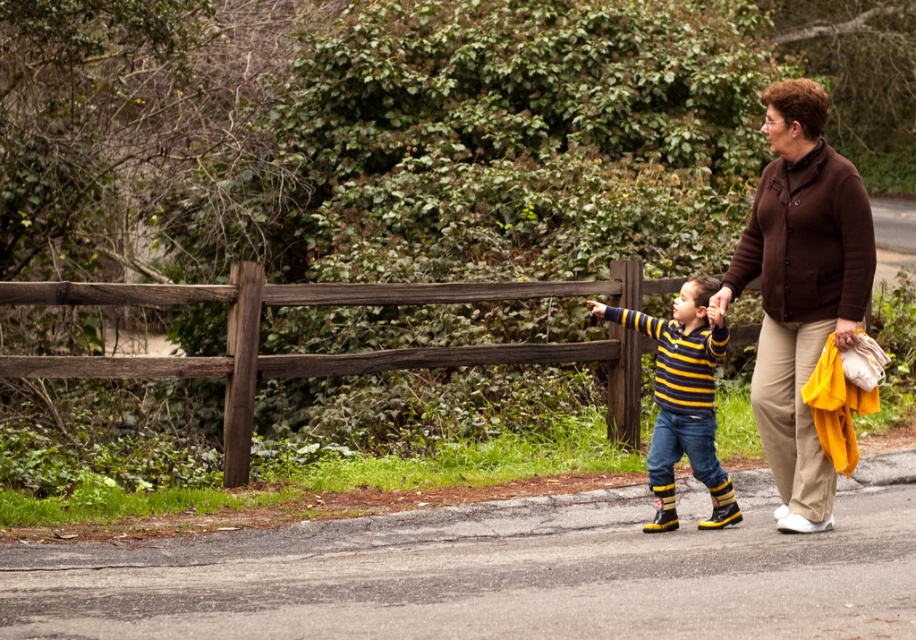
You are a photographer trying to capture a candid shot of the two people in the scene. To ensure both subjects are in frame, you need to position your camera so that the brown cardigan at right and the striped knit sweater at center are visible. Based on their positions, which direction should you move your camera to include both subjects?

Since the brown cardigan at right is to the right of the striped knit sweater at center, you should move your camera slightly to the right to ensure both the brown cardigan at right and the striped knit sweater at center are in frame.

Looking at this image, you are a photographer trying to capture a photo of the brown cardigan at right and the brown wooden fence at left. Which object should you zoom in on to make them appear the same size in the photo?

The brown cardigan at right is thinner than the brown wooden fence at left, so you should zoom in on the brown cardigan at right to make them appear the same size in the photo.